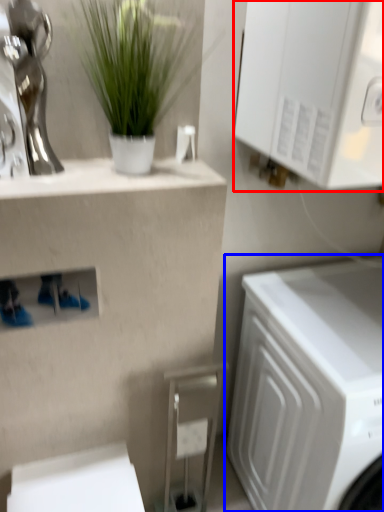
Question: Which point is further to the camera, cabinetry (highlighted by a red box) or washing machine (highlighted by a blue box)?

Choices:
 (A) cabinetry
 (B) washing machine

Answer: (B)